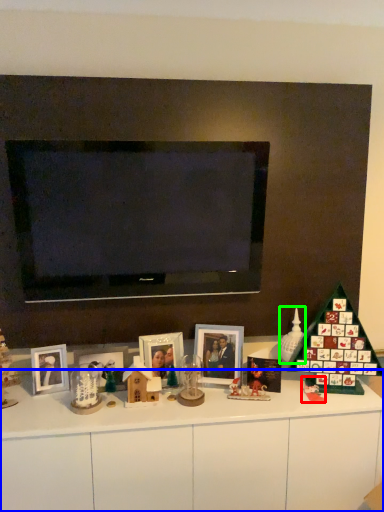
Question: Which object is positioned closest to toy (highlighted by a red box)? Select from dresser (highlighted by a blue box) and toy (highlighted by a green box).

Choices:
 (A) dresser
 (B) toy

Answer: (B)